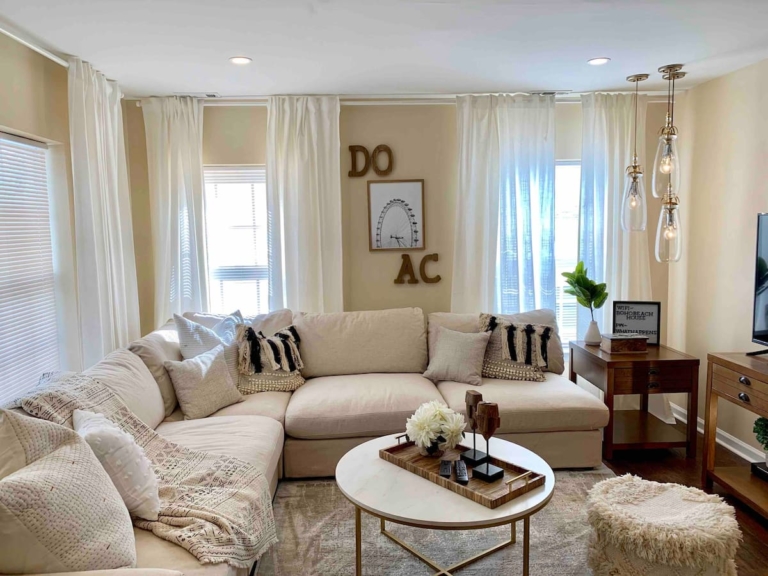
Where is `cushion`? cushion is located at coordinates (157, 562), (223, 428), (153, 396), (157, 347), (263, 405), (333, 410), (266, 321), (363, 331), (498, 395), (467, 321).